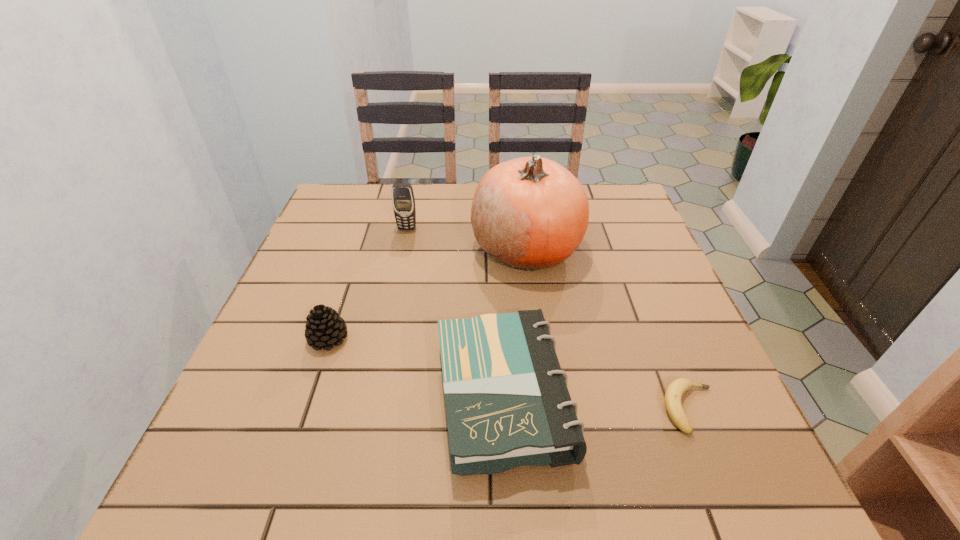
In order to click on the tallest object in this screenshot , I will do `click(530, 213)`.

At what (x,y) coordinates should I click in order to perform the action: click on cellular telephone. Please return your answer as a coordinate pair (x, y). The image size is (960, 540). Looking at the image, I should click on (403, 200).

Locate an element on the screen. This screenshot has height=540, width=960. the fourth shortest object is located at coordinates (403, 200).

Find the location of a particular element. the leftmost object is located at coordinates (324, 327).

The image size is (960, 540). I want to click on paperback book, so coord(507,403).

The width and height of the screenshot is (960, 540). I want to click on the shortest object, so click(x=675, y=390).

I want to click on banana, so click(x=675, y=390).

Where is `free spot located 0.130m on the left of the tallest object`? This screenshot has width=960, height=540. free spot located 0.130m on the left of the tallest object is located at coordinates (421, 248).

Locate an element on the screen. The width and height of the screenshot is (960, 540). free space located on the front face of the second object from left to right is located at coordinates (395, 284).

Where is `vacant space located at the narrow end of the pinecone`? Image resolution: width=960 pixels, height=540 pixels. vacant space located at the narrow end of the pinecone is located at coordinates point(405,339).